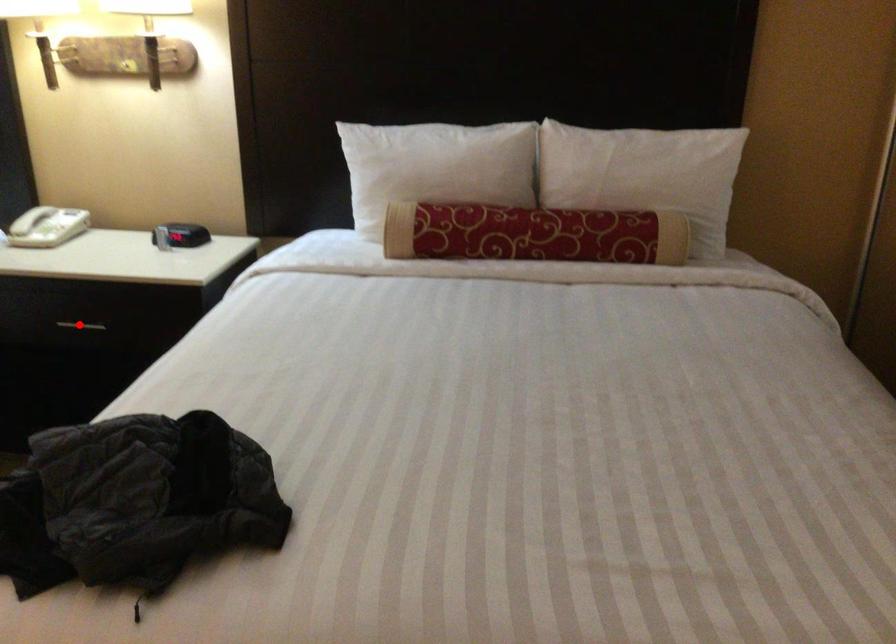
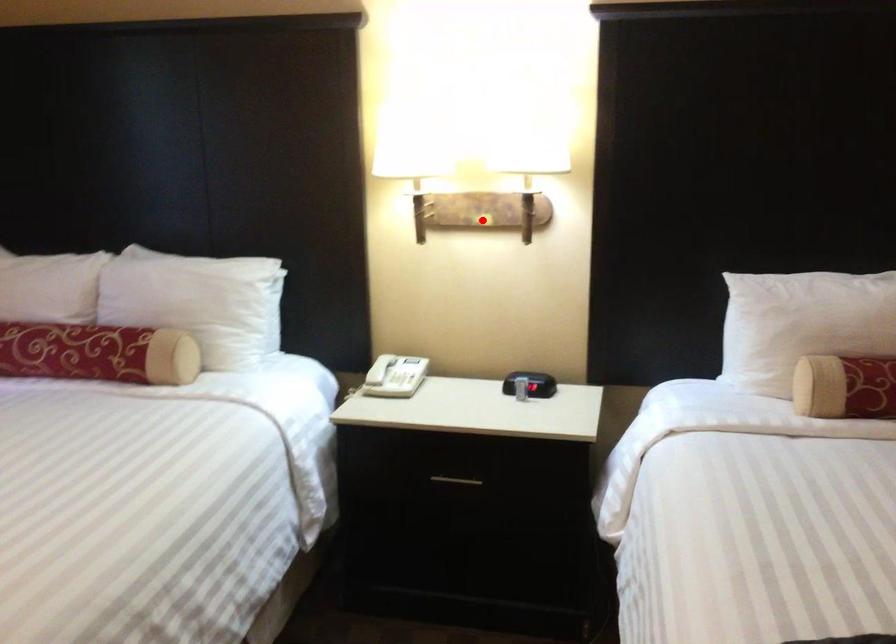
I am providing you with two images of the same scene from different viewpoints. A red point is marked on the first image and another point is marked on the second image. Are the points marked in image1 and image2 representing the same 3D position?

No